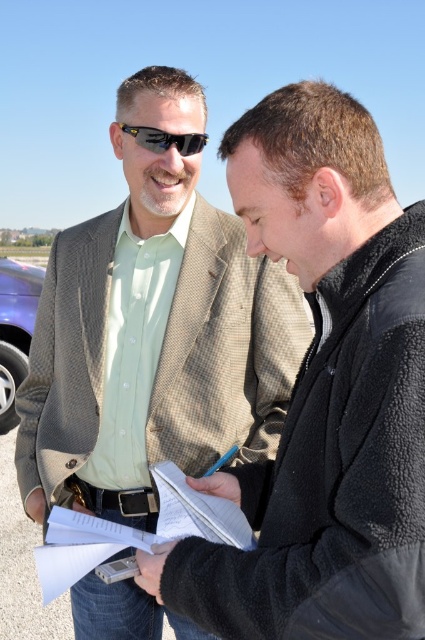
Question: Which point is closer to the camera?

Choices:
 (A) metallic purple car at left
 (B) white paper at lower center
 (C) matte brown blazer at center
 (D) black plastic sunglasses at upper center

Answer: (B)

Question: Does matte brown blazer at center lie behind white paper at lower center?

Choices:
 (A) yes
 (B) no

Answer: (A)

Question: Which object is farther from the camera taking this photo?

Choices:
 (A) matte brown blazer at center
 (B) white paper at center

Answer: (A)

Question: Which object is closer to the camera taking this photo?

Choices:
 (A) metallic purple car at left
 (B) light brown textured blazer at center

Answer: (B)

Question: In this image, where is matte brown blazer at center located relative to white paper at center?

Choices:
 (A) above
 (B) below

Answer: (A)

Question: Where is white paper at lower center located in relation to metallic purple car at left in the image?

Choices:
 (A) left
 (B) right

Answer: (B)